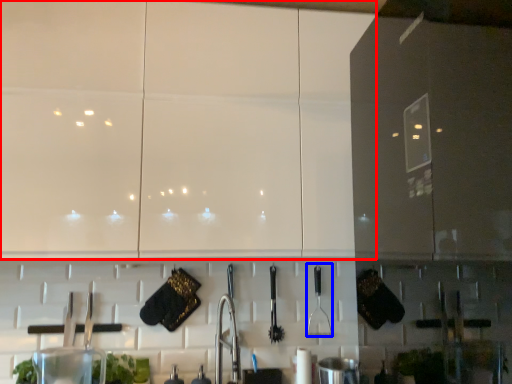
Question: Which object appears closest to the camera in this image, cabinetry (highlighted by a red box) or silverware (highlighted by a blue box)?

Choices:
 (A) cabinetry
 (B) silverware

Answer: (A)